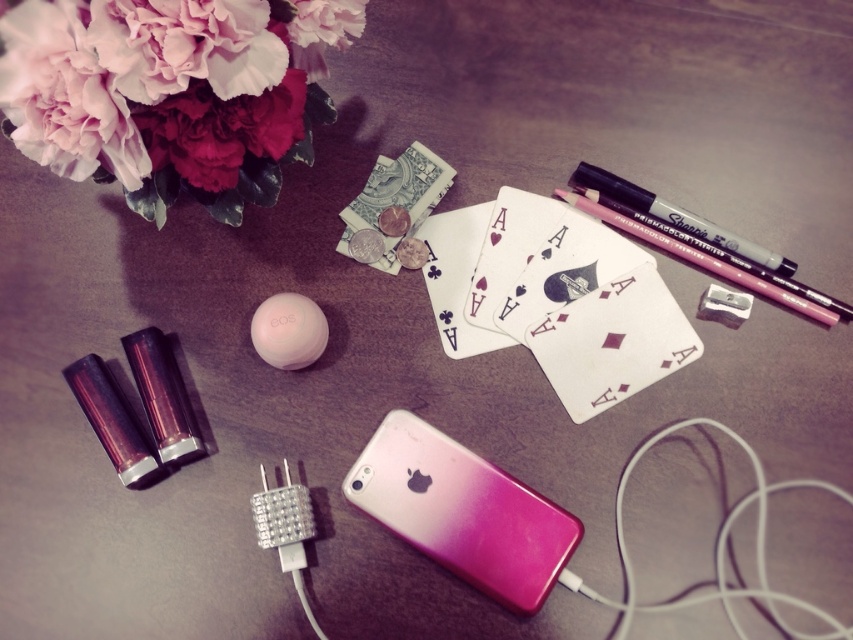
Question: Based on their relative distances, which object is nearer to the pink matte flower at upper left?

Choices:
 (A) pink matte pencil at upper right
 (B) pink gradient plastic ipod at center

Answer: (B)

Question: Does pink matte pencil at upper right have a greater width compared to matte black marker at upper right?

Choices:
 (A) yes
 (B) no

Answer: (A)

Question: Is pink matte flower at upper left above pink matte pencil at upper right?

Choices:
 (A) yes
 (B) no

Answer: (A)

Question: Which point appears farthest from the camera in this image?

Choices:
 (A) (541, 577)
 (B) (674, 241)
 (C) (223, 102)

Answer: (B)

Question: Which of these objects is positioned farthest from the matte black marker at upper right?

Choices:
 (A) pink matte flower at upper left
 (B) pink matte pencil at upper right

Answer: (A)

Question: Is pink matte flower at upper left in front of matte black marker at upper right?

Choices:
 (A) yes
 (B) no

Answer: (A)